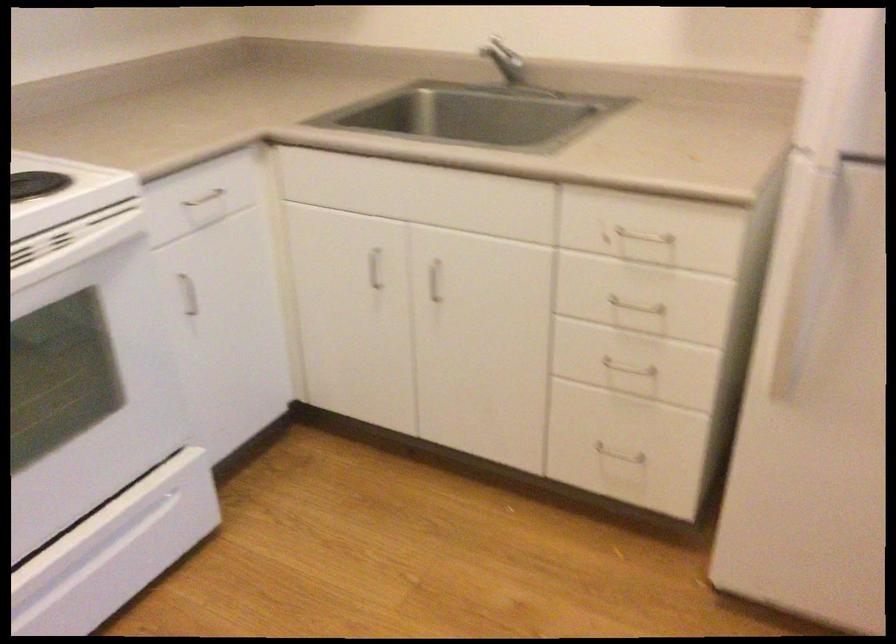
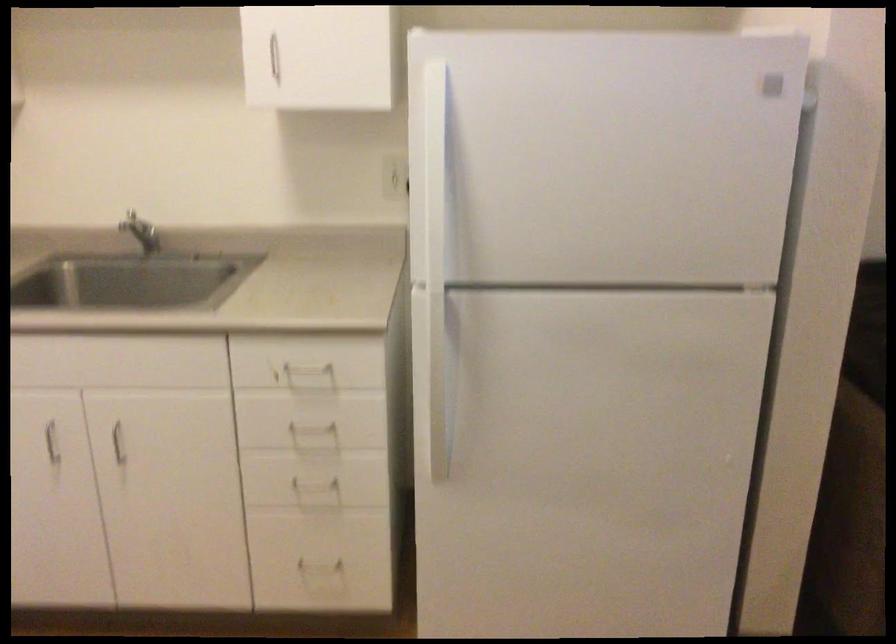
In the second image, find the point that corresponds to point 633,315 in the first image.

(314, 436)